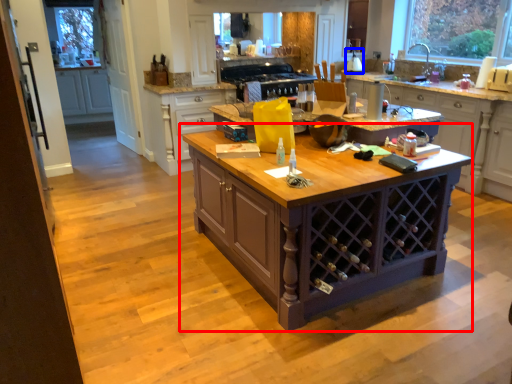
Question: Which of the following is the farthest to the observer, table (highlighted by a red box) or appliance (highlighted by a blue box)?

Choices:
 (A) table
 (B) appliance

Answer: (B)